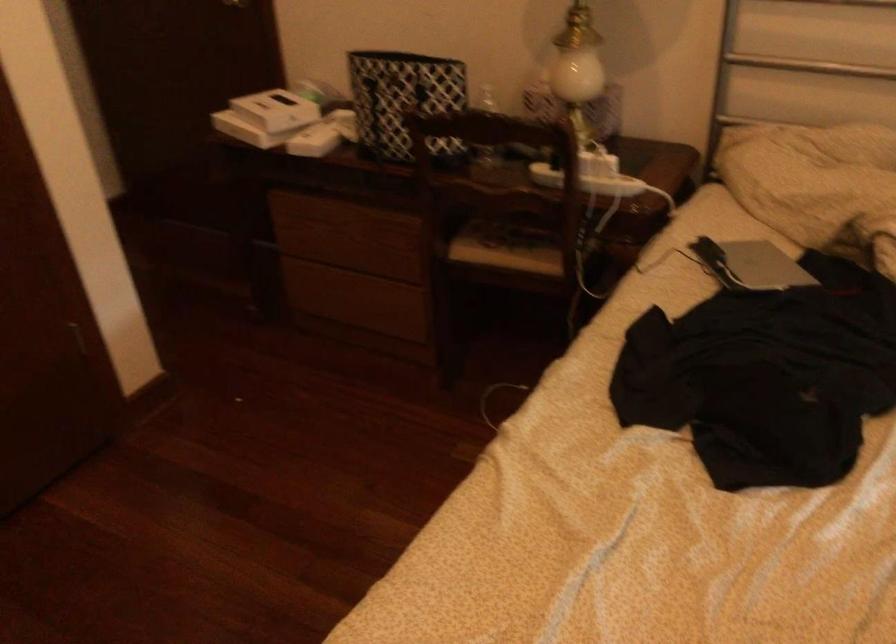
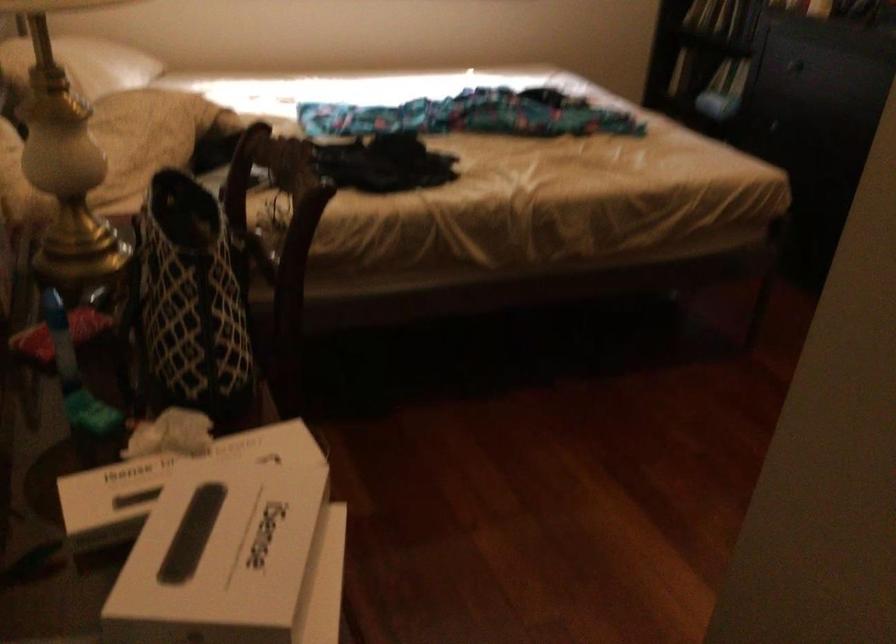
The point at (263, 102) is marked in the first image. Where is the corresponding point in the second image?

(234, 560)